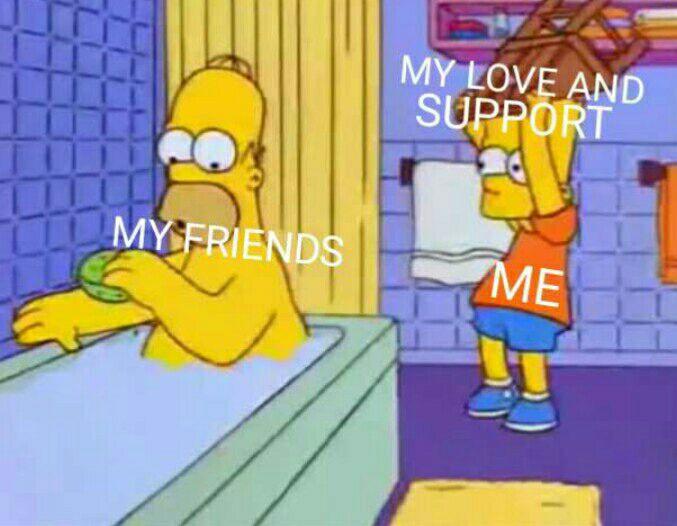
Image resolution: width=677 pixels, height=526 pixels. Find the location of `sponge`. sponge is located at coordinates (109, 284).